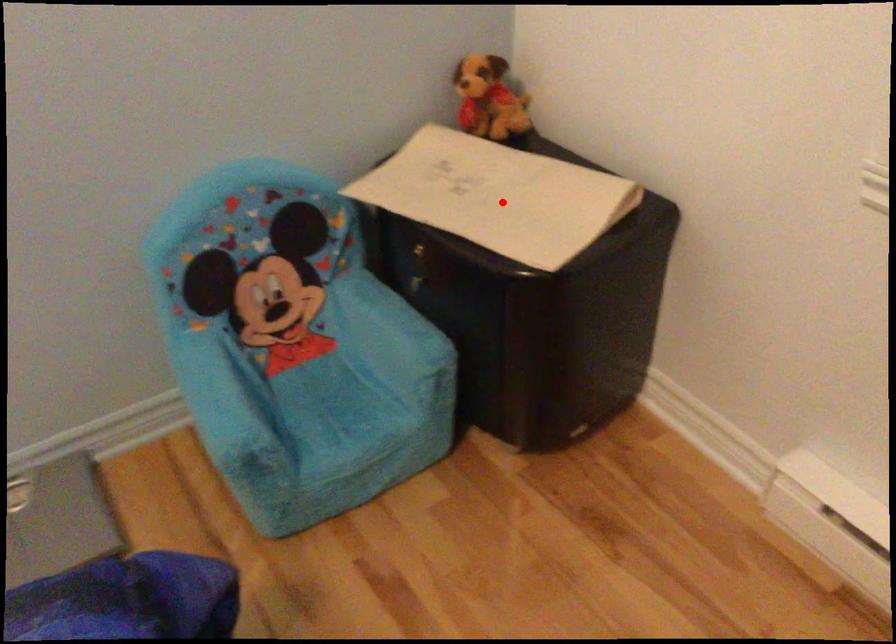
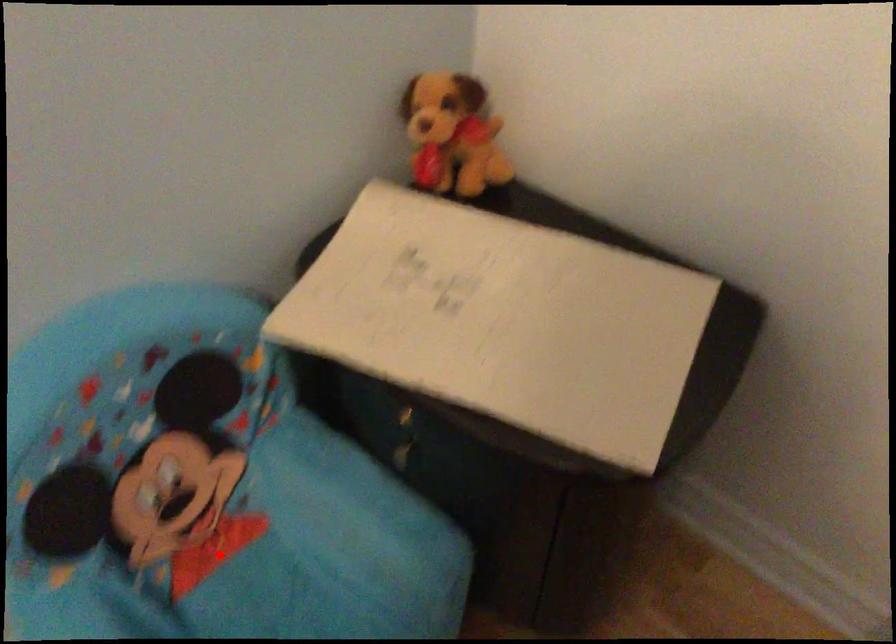
I am providing you with two images of the same scene from different viewpoints. A red point is marked on the first image and another point is marked on the second image. Are the points marked in image1 and image2 representing the same 3D position?

No